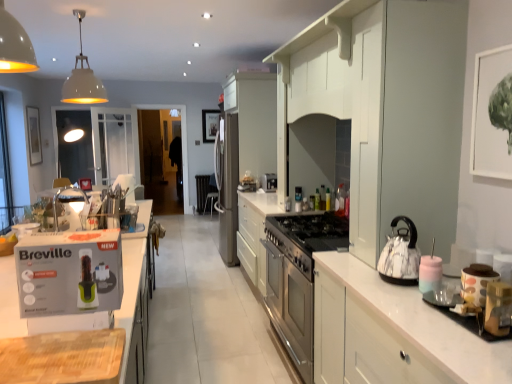
Question: Is translucent plastic bottle at center, the first bottle positioned from the back, wider or thinner than white marble teapot at right?

Choices:
 (A) thin
 (B) wide

Answer: (A)

Question: Do you think translucent plastic bottle at center, acting as the second bottle starting from the right, is within white marble teapot at right, or outside of it?

Choices:
 (A) inside
 (B) outside

Answer: (B)

Question: Which object is positioned farthest from the satin silver coffee machine at center?

Choices:
 (A) translucent plastic bottle at upper center, which is the 2th bottle in left-to-right order
 (B) black fabric chair at center
 (C) white matte cabinet at right, which appears as the third cabinetry when viewed from the back
 (D) white cardboard box at left
 (E) white marble teapot at right

Answer: (B)

Question: Which object is positioned farthest from the satin silver coffee machine at center?

Choices:
 (A) satin white cabinetry at center, positioned as the 2th cabinetry in back-to-front order
 (B) white cardboard box at left
 (C) matte white picture frame at upper left, marked as the 2th picture frame in a right-to-left arrangement
 (D) black fabric chair at center
 (E) black matte picture frame at upper center, which appears as the 2th picture frame when viewed from the left

Answer: (E)